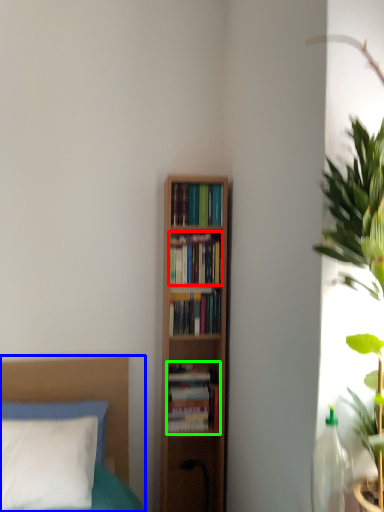
Question: Which object is positioned closest to book (highlighted by a red box)? Select from bed (highlighted by a blue box) and book (highlighted by a green box).

Choices:
 (A) bed
 (B) book

Answer: (B)